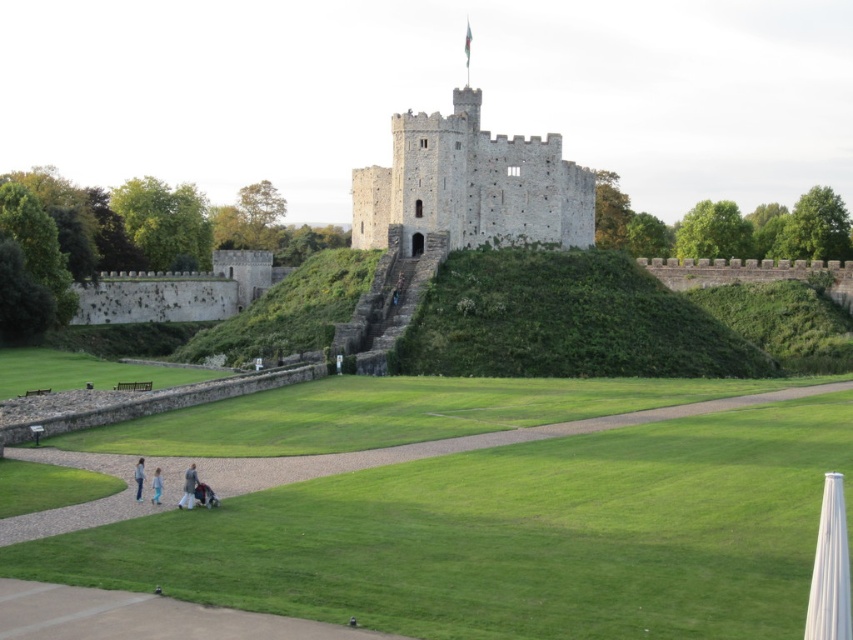
Question: Which of the following is the farthest from the observer?

Choices:
 (A) blue denim jeans at lower left
 (B) green grass at center
 (C) light brown fabric jacket at lower center
 (D) stone tower at center

Answer: (D)

Question: In this image, where is light brown fabric jacket at lower center located relative to blue denim jeans at lower left?

Choices:
 (A) left
 (B) right

Answer: (B)

Question: From the image, what is the correct spatial relationship of green grass at center in relation to light brown fabric jacket at lower center?

Choices:
 (A) left
 (B) right

Answer: (B)

Question: Which object is closer to the camera taking this photo?

Choices:
 (A) blue denim jeans at lower left
 (B) light brown fabric jacket at lower center
 (C) green grass at center

Answer: (C)

Question: Which of the following is the closest to the observer?

Choices:
 (A) (178, 508)
 (B) (636, 550)

Answer: (B)

Question: Can you confirm if green grass at center is smaller than light blue jeans at lower left?

Choices:
 (A) yes
 (B) no

Answer: (B)